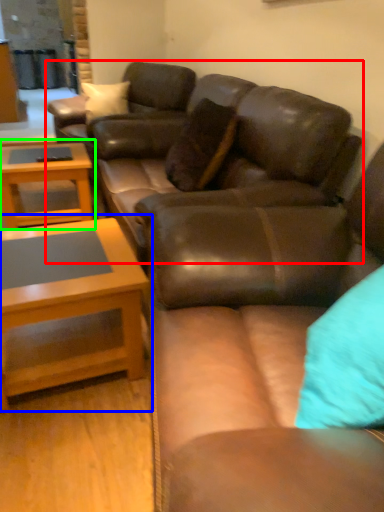
Question: Based on their relative distances, which object is nearer to studio couch (highlighted by a red box)? Choose from coffee table (highlighted by a blue box) and coffee table (highlighted by a green box).

Choices:
 (A) coffee table
 (B) coffee table

Answer: (A)